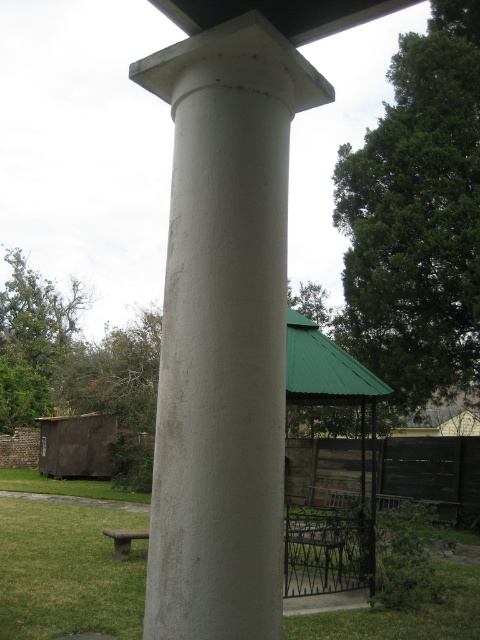
Question: Is green grass at lower left to the left of wooden picnic table at lower left from the viewer's perspective?

Choices:
 (A) no
 (B) yes

Answer: (A)

Question: Estimate the real-world distances between objects in this image. Which object is farther from the white smooth column at center?

Choices:
 (A) green grass at lower left
 (B) wooden picnic table at lower left

Answer: (A)

Question: Among these points, which one is farthest from the camera?

Choices:
 (A) (7, 577)
 (B) (126, 545)
 (C) (160, 97)

Answer: (B)

Question: Estimate the real-world distances between objects in this image. Which object is closer to the white smooth column at center?

Choices:
 (A) green grass at lower left
 (B) wooden picnic table at lower left

Answer: (B)

Question: Can you confirm if white smooth column at center is positioned to the left of wooden picnic table at lower left?

Choices:
 (A) yes
 (B) no

Answer: (B)

Question: Is white smooth column at center thinner than wooden picnic table at lower left?

Choices:
 (A) no
 (B) yes

Answer: (B)